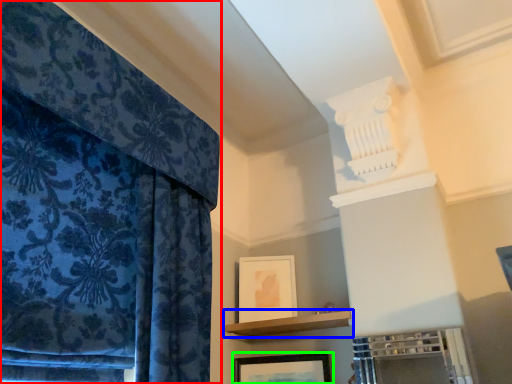
Question: Which object is positioned farthest from curtain (highlighted by a red box)? Select from shelf (highlighted by a blue box) and picture frame (highlighted by a green box).

Choices:
 (A) shelf
 (B) picture frame

Answer: (B)